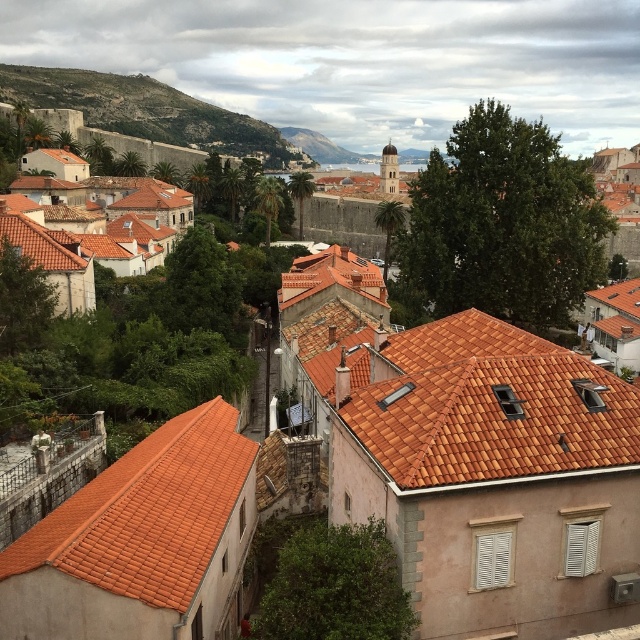
You are a drone operator tasked with capturing aerial footage of the historic town. Your drone has a maximum flight range of 300 meters from its starting position. If you take off from the terracotta tile roof at lower left, will you be able to fly over the green grassy hillside at upper left without exceeding the drone range limit?

The terracotta tile roof at lower left and green grassy hillside at upper left are 330.21 meters apart. Since the drone has a maximum range of 300 meters, it cannot reach the green grassy hillside at upper left from the terracotta tile roof at lower left without exceeding its flight range limit.

You are a tourist in Dubrovnik and want to take a photo of both the terracotta tile roof at lower left and the green grassy hillside at upper left. Which object should you focus on first to ensure both are in the frame?

You should focus on the green grassy hillside at upper left first because it occupies more space than the terracotta tile roof at lower left, ensuring both fit in the frame.

You are a tourist standing in the historic town and want to take a photo of the terracotta tile roof at lower left and the green grassy hillside at upper left. Which object should you point your camera towards first if you want to capture both in one shot?

You should point your camera towards the green grassy hillside at upper left first because the terracotta tile roof at lower left is positioned under it, meaning the roof is closer to the camera and the hillside is further back. By framing the shot with the hillside at the top and the roof below, both elements can be included in the composition.